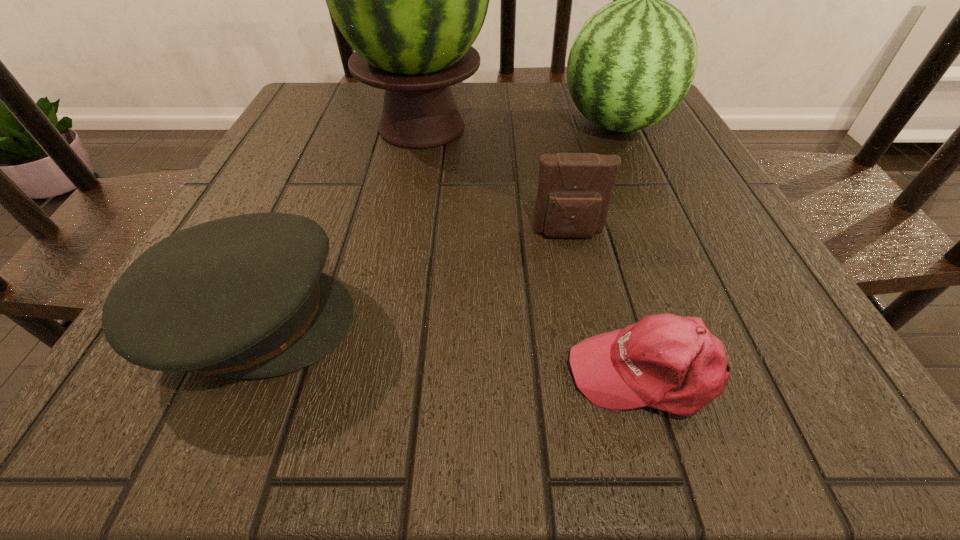
In the image, there is a desktop. Where is `vacant space at the near right corner`? The image size is (960, 540). vacant space at the near right corner is located at coordinates (800, 380).

Identify the location of free space between the baseball cap and the third farthest object. (608, 303).

The width and height of the screenshot is (960, 540). Find the location of `empty location between the pouch and the beret`. empty location between the pouch and the beret is located at coordinates coord(411,278).

Where is `free point between the taller watermelon and the shortest object`? This screenshot has height=540, width=960. free point between the taller watermelon and the shortest object is located at coordinates (535, 250).

At what (x,y) coordinates should I click in order to perform the action: click on free point between the third farthest object and the left watermelon. Please return your answer as a coordinate pair (x, y). Looking at the image, I should click on (495, 181).

Find the location of a particular element. vacant area that lies between the left watermelon and the beret is located at coordinates (338, 224).

The image size is (960, 540). I want to click on free space between the beret and the shortest object, so click(450, 347).

The width and height of the screenshot is (960, 540). Identify the location of vacant space that's between the third nearest object and the tallest object. (495, 181).

Where is `empty space between the baseball cap and the second tallest object`? This screenshot has height=540, width=960. empty space between the baseball cap and the second tallest object is located at coordinates (632, 249).

Where is `free space between the third farthest object and the beret`? free space between the third farthest object and the beret is located at coordinates 411,278.